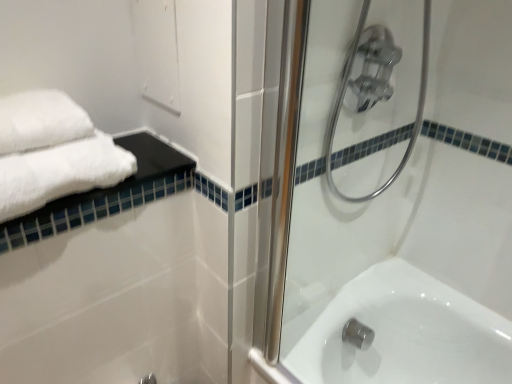
The width and height of the screenshot is (512, 384). Describe the element at coordinates (390, 204) in the screenshot. I see `clear glass shower door at upper center` at that location.

What is the approximate height of clear glass shower door at upper center?

clear glass shower door at upper center is 92.08 centimeters tall.

Locate an element on the screen. clear glass shower door at upper center is located at coordinates (390, 204).

What do you see at coordinates (60, 173) in the screenshot?
I see `white soft towel at upper left` at bounding box center [60, 173].

The image size is (512, 384). I want to click on white soft towel at upper left, so click(60, 173).

This screenshot has width=512, height=384. Identify the location of clear glass shower door at upper center. (390, 204).

Is clear glass shower door at upper center to the right of white soft towel at upper left from the viewer's perspective?

Yes.

Which object is closer to the camera, clear glass shower door at upper center or white soft towel at upper left?

clear glass shower door at upper center is more forward.

Which is farther, (x=317, y=205) or (x=81, y=178)?

The point (x=317, y=205) is behind.

From the image's perspective, which one is positioned higher, clear glass shower door at upper center or white soft towel at upper left?

white soft towel at upper left appears higher in the image.

Based on the photo, from a real-world perspective, between clear glass shower door at upper center and white soft towel at upper left, who is vertically lower?

clear glass shower door at upper center, from a real-world perspective.

Is clear glass shower door at upper center thinner than white soft towel at upper left?

Indeed, clear glass shower door at upper center has a lesser width compared to white soft towel at upper left.

Considering the sizes of objects clear glass shower door at upper center and white soft towel at upper left in the image provided, who is taller, clear glass shower door at upper center or white soft towel at upper left?

Standing taller between the two is clear glass shower door at upper center.

Who is bigger, clear glass shower door at upper center or white soft towel at upper left?

clear glass shower door at upper center is bigger.

Looking at this image, do you think clear glass shower door at upper center is within white soft towel at upper left, or outside of it?

clear glass shower door at upper center is not inside white soft towel at upper left, it's outside.

Are clear glass shower door at upper center and white soft towel at upper left located far from each other?

Answer: clear glass shower door at upper center is actually quite close to white soft towel at upper left.

Is clear glass shower door at upper center aimed at white soft towel at upper left?

No.

The image size is (512, 384). I want to click on shower door below the white soft towel at upper left (from a real-world perspective), so click(x=390, y=204).

Considering the relative positions of white soft towel at upper left and clear glass shower door at upper center in the image provided, is white soft towel at upper left to the left or to the right of clear glass shower door at upper center?

From the image, it's evident that white soft towel at upper left is to the left of clear glass shower door at upper center.

Which object is closer to the camera, white soft towel at upper left or clear glass shower door at upper center?

clear glass shower door at upper center is closer to the camera.

Which is behind, point (90, 147) or point (497, 373)?

Point (497, 373)

From the image's perspective, is white soft towel at upper left positioned above or below clear glass shower door at upper center?

white soft towel at upper left is situated higher than clear glass shower door at upper center in the image.

From a real-world perspective, is white soft towel at upper left on top of clear glass shower door at upper center?

Yes.

Which object is wider, white soft towel at upper left or clear glass shower door at upper center?

With larger width is white soft towel at upper left.

Between white soft towel at upper left and clear glass shower door at upper center, which one has less height?

white soft towel at upper left is shorter.

Between white soft towel at upper left and clear glass shower door at upper center, which one has smaller size?

Smaller between the two is white soft towel at upper left.

Is white soft towel at upper left situated inside clear glass shower door at upper center or outside?

white soft towel at upper left is spatially situated outside clear glass shower door at upper center.

From the picture: Is white soft towel at upper left far from clear glass shower door at upper center?

No, there isn't a large distance between white soft towel at upper left and clear glass shower door at upper center.

Based on the photo, is white soft towel at upper left looking in the opposite direction of clear glass shower door at upper center?

That's not correct — white soft towel at upper left is not looking away from clear glass shower door at upper center.

What's the angular difference between white soft towel at upper left and clear glass shower door at upper center's facing directions?

The facing directions of white soft towel at upper left and clear glass shower door at upper center are 89.4 degrees apart.

Find the location of `shower door located on the right of white soft towel at upper left`. shower door located on the right of white soft towel at upper left is located at coordinates (x=390, y=204).

This screenshot has height=384, width=512. What are the coordinates of `towel to the left of clear glass shower door at upper center` in the screenshot? It's located at (60, 173).

The image size is (512, 384). Identify the location of towel behind the clear glass shower door at upper center. (60, 173).